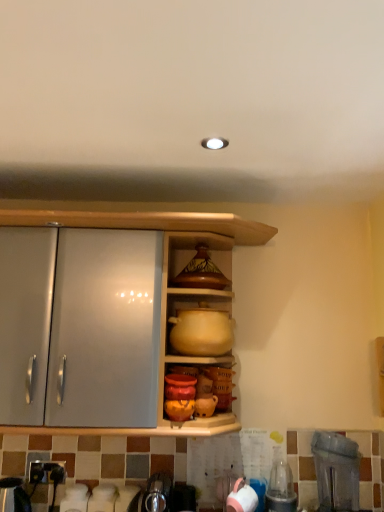
Question: From a real-world perspective, is matte yellow clay pot at center physically located above or below transparent plastic blender at lower right, which is counted as the 2th appliance, starting from the left?

Choices:
 (A) above
 (B) below

Answer: (A)

Question: Is matte yellow clay pot at center inside the boundaries of transparent plastic blender at lower right, which ranks as the first appliance in right-to-left order, or outside?

Choices:
 (A) outside
 (B) inside

Answer: (A)

Question: Based on their relative distances, which object is farther from the pink matte cup at lower center?

Choices:
 (A) matte brown ceramic pot at upper center
 (B) metallic silver kettle at lower left, the 1th appliance viewed from the left
 (C) matte yellow clay pot at center
 (D) transparent plastic blender at lower right, which is counted as the 2th appliance, starting from the left

Answer: (A)

Question: Estimate the real-world distances between objects in this image. Which object is closer to the metallic silver kettle at lower left, the 1th appliance viewed from the left?

Choices:
 (A) matte yellow clay pot at center
 (B) transparent plastic blender at lower right, which is counted as the 2th appliance, starting from the left
 (C) pink matte cup at lower center
 (D) matte brown ceramic pot at upper center

Answer: (C)